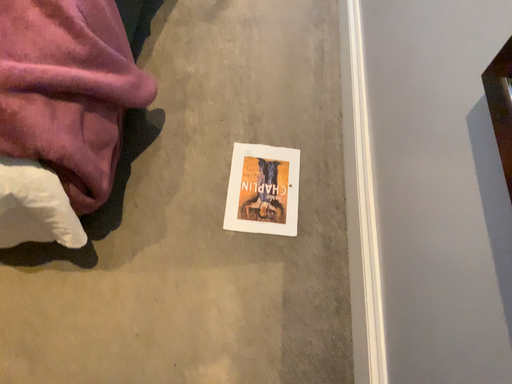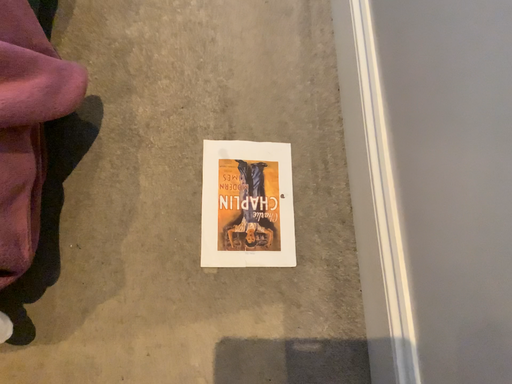
Question: How did the camera likely rotate when shooting the video?

Choices:
 (A) rotated downward
 (B) rotated upward

Answer: (A)